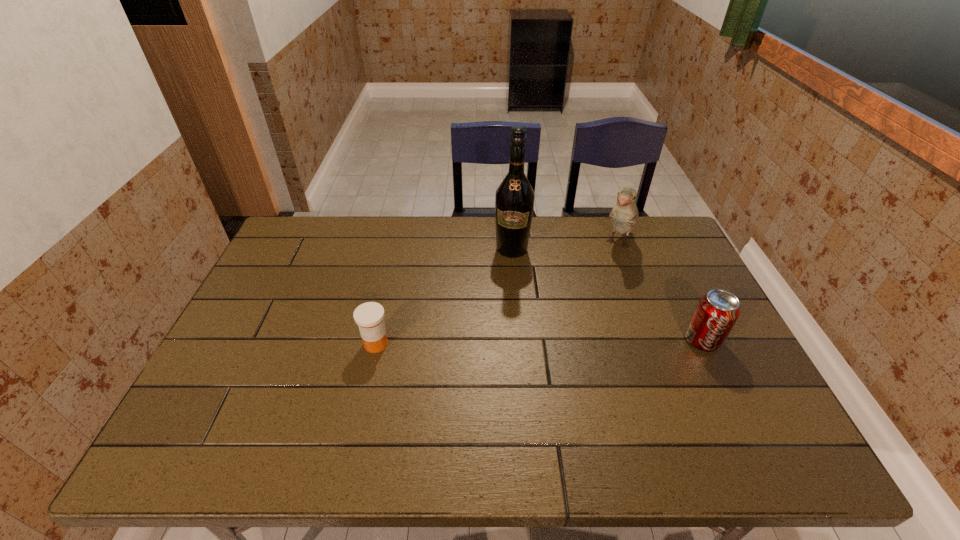
In order to click on free space on the desktop that is between the shortest object and the second shortest object and is positioned at the face of the bird in this screenshot , I will do `click(564, 342)`.

Locate an element on the screen. vacant space on the desktop that is between the leftmost object and the soda can and is positioned on the label of the second object from left to right is located at coordinates (501, 342).